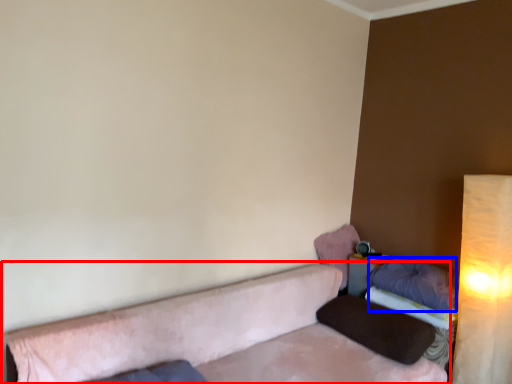
Question: Which object is closer to the camera taking this photo, studio couch (highlighted by a red box) or pillow (highlighted by a blue box)?

Choices:
 (A) studio couch
 (B) pillow

Answer: (A)